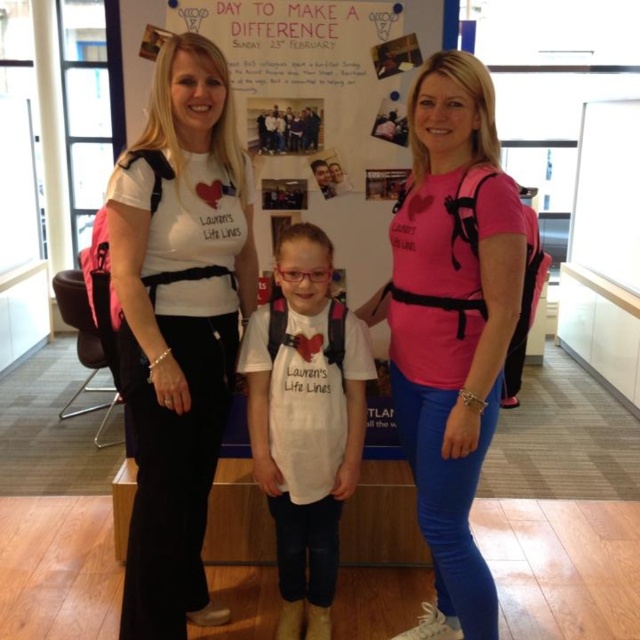
Question: Is white matte t-shirt at center below white matte shirt at center?

Choices:
 (A) no
 (B) yes

Answer: (A)

Question: Which point is closer to the camera?

Choices:
 (A) (172, 314)
 (B) (458, 529)
 (C) (323, 484)

Answer: (A)

Question: Which point is farther from the camera taking this photo?

Choices:
 (A) (282, 314)
 (B) (214, 609)
 (C) (461, 349)

Answer: (B)

Question: Which point is farther from the camera taking this photo?

Choices:
 (A) (467, 380)
 (B) (150, 148)
 (C) (317, 508)

Answer: (C)

Question: Is the position of white matte t-shirt at center less distant than that of white matte shirt at center?

Choices:
 (A) no
 (B) yes

Answer: (B)

Question: Is white matte t-shirt at center to the right of white matte shirt at center from the viewer's perspective?

Choices:
 (A) yes
 (B) no

Answer: (B)